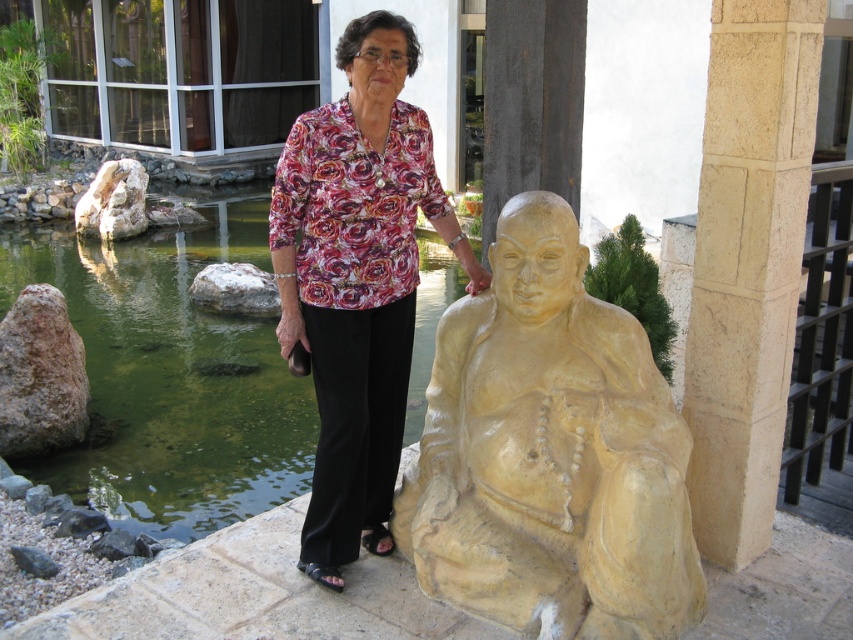
Question: Is green water at pond left thinner than beige stone pillar at right?

Choices:
 (A) yes
 (B) no

Answer: (A)

Question: Estimate the real-world distances between objects in this image. Which object is closer to the green water at pond left?

Choices:
 (A) floral fabric blouse at center
 (B) beige stone pillar at right

Answer: (A)

Question: Is green water at pond left above beige stone pillar at right?

Choices:
 (A) no
 (B) yes

Answer: (B)

Question: Which object is farther from the camera taking this photo?

Choices:
 (A) floral fabric blouse at center
 (B) green water at pond left
 (C) beige stone pillar at right

Answer: (B)

Question: Is the position of green water at pond left more distant than that of floral fabric blouse at center?

Choices:
 (A) no
 (B) yes

Answer: (B)

Question: Which of the following is the farthest from the observer?

Choices:
 (A) (78, 280)
 (B) (386, 422)
 (C) (445, 556)
 (D) (753, 440)

Answer: (A)